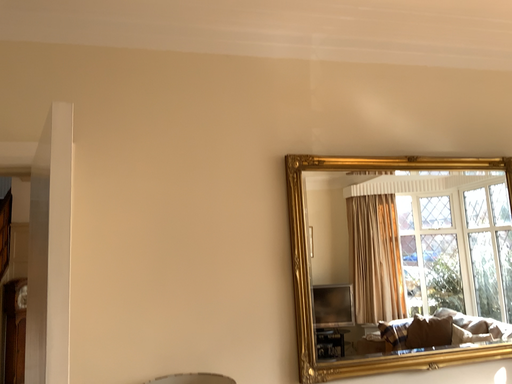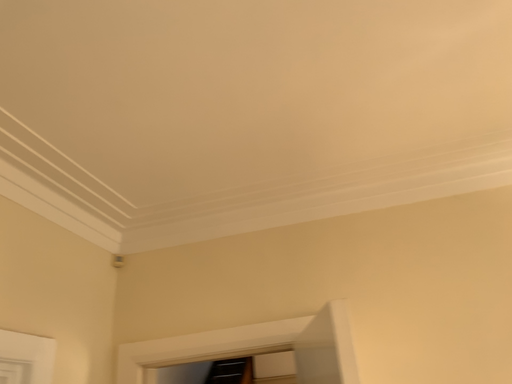
Question: How did the camera likely rotate when shooting the video?

Choices:
 (A) rotated upward
 (B) rotated downward

Answer: (A)